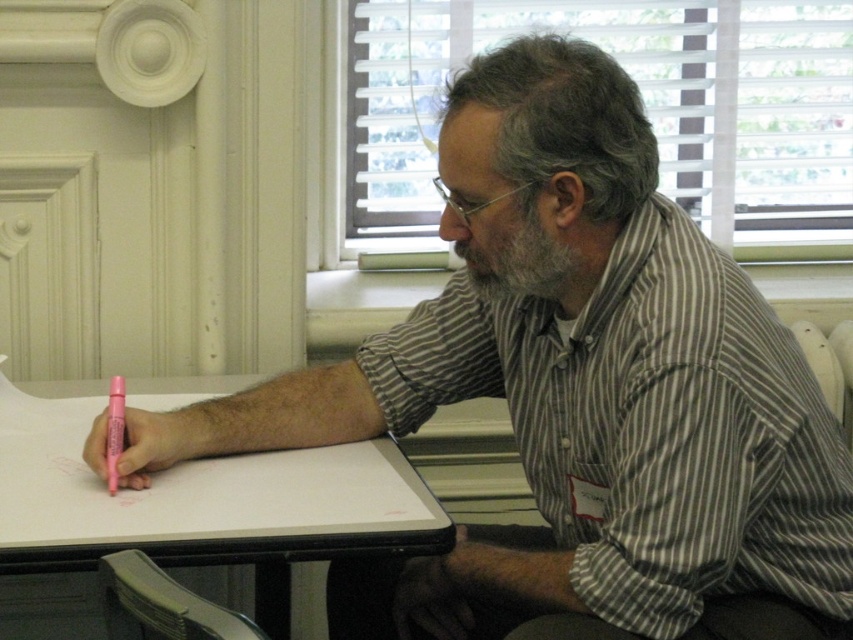
Is striped cotton shirt at upper right wider than pink plastic pen at lower left?

Indeed, striped cotton shirt at upper right has a greater width compared to pink plastic pen at lower left.

Does striped cotton shirt at upper right appear under pink plastic pen at lower left?

Actually, striped cotton shirt at upper right is above pink plastic pen at lower left.

Who is more forward, (709, 316) or (115, 438)?

Point (709, 316) is more forward.

Find the location of a particular element. striped cotton shirt at upper right is located at coordinates (648, 428).

Does striped cotton shirt at upper right have a larger size compared to white matte table at lower left?

Yes.

What do you see at coordinates (648, 428) in the screenshot? This screenshot has width=853, height=640. I see `striped cotton shirt at upper right` at bounding box center [648, 428].

I want to click on striped cotton shirt at upper right, so click(648, 428).

Which is more to the right, white matte table at lower left or pink plastic pen at lower left?

→ white matte table at lower left is more to the right.

Looking at this image, who is positioned more to the left, white matte table at lower left or pink plastic pen at lower left?

pink plastic pen at lower left is more to the left.

At what (x,y) coordinates should I click in order to perform the action: click on white matte table at lower left. Please return your answer as a coordinate pair (x, y). The width and height of the screenshot is (853, 640). Looking at the image, I should click on (221, 506).